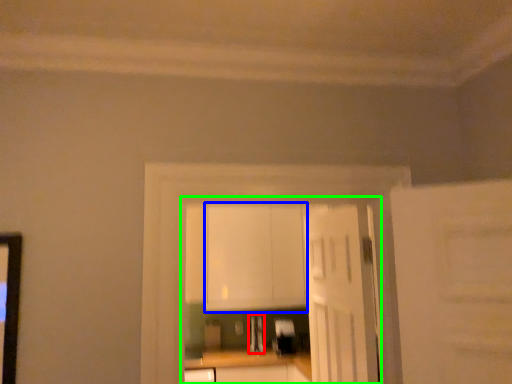
Question: Which object is the closest to the appliance (highlighted by a red box)? Choose among these: cabinetry (highlighted by a blue box) or entertainment center (highlighted by a green box).

Choices:
 (A) cabinetry
 (B) entertainment center

Answer: (B)